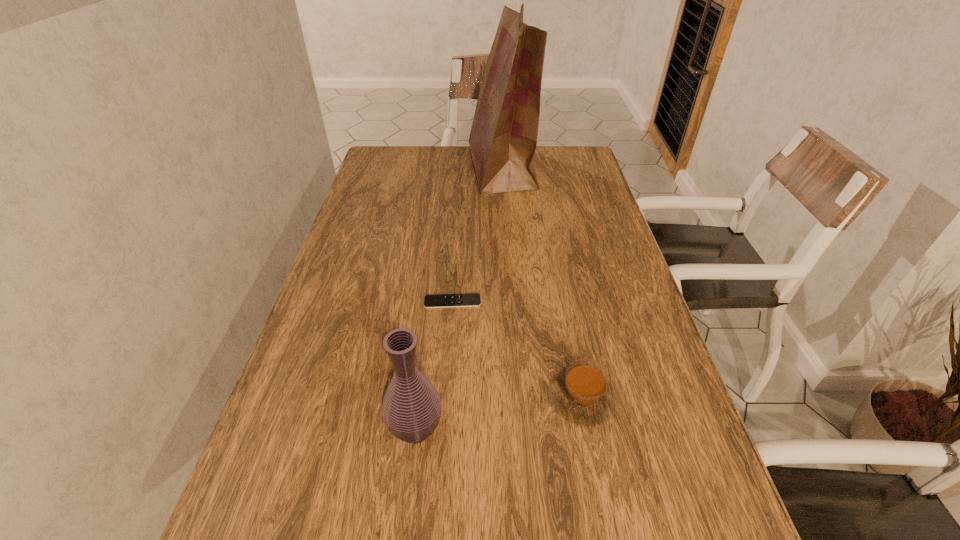
At what (x,y) coordinates should I click in order to perform the action: click on vacant position in the image that satisfies the following two spatial constraints: 1. on the front side of the cappuccino; 2. on the left side of the third nearest object. Please return your answer as a coordinate pair (x, y). Looking at the image, I should click on (446, 399).

This screenshot has height=540, width=960. In order to click on vacant position in the image that satisfies the following two spatial constraints: 1. on the front-facing side of the tallest object; 2. on the back side of the second shortest object in this screenshot , I will do `click(519, 399)`.

Find the location of a particular element. vacant area in the image that satisfies the following two spatial constraints: 1. on the front-facing side of the grocery bag; 2. on the right side of the second shortest object is located at coordinates (519, 399).

Where is `free spot that satisfies the following two spatial constraints: 1. on the front-facing side of the grocery bag; 2. on the back side of the third tallest object`? free spot that satisfies the following two spatial constraints: 1. on the front-facing side of the grocery bag; 2. on the back side of the third tallest object is located at coordinates (519, 399).

You are a GUI agent. You are given a task and a screenshot of the screen. Output one action in this format:
    pyautogui.click(x=<x>, y=<y>)
    Task: Click on the free space that satisfies the following two spatial constraints: 1. on the front-facing side of the tallest object; 2. on the right side of the cappuccino
    This screenshot has width=960, height=540.
    Given the screenshot: What is the action you would take?
    pyautogui.click(x=519, y=399)